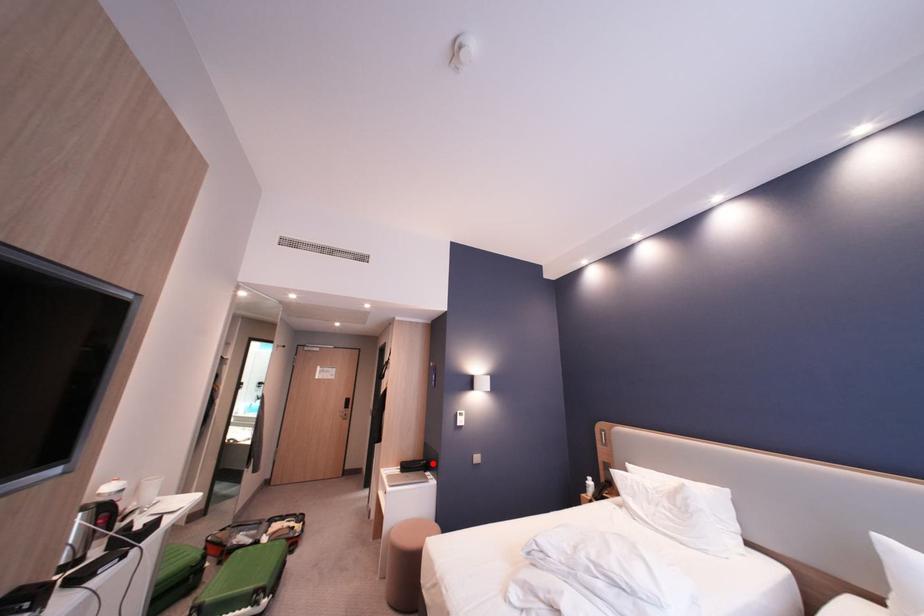
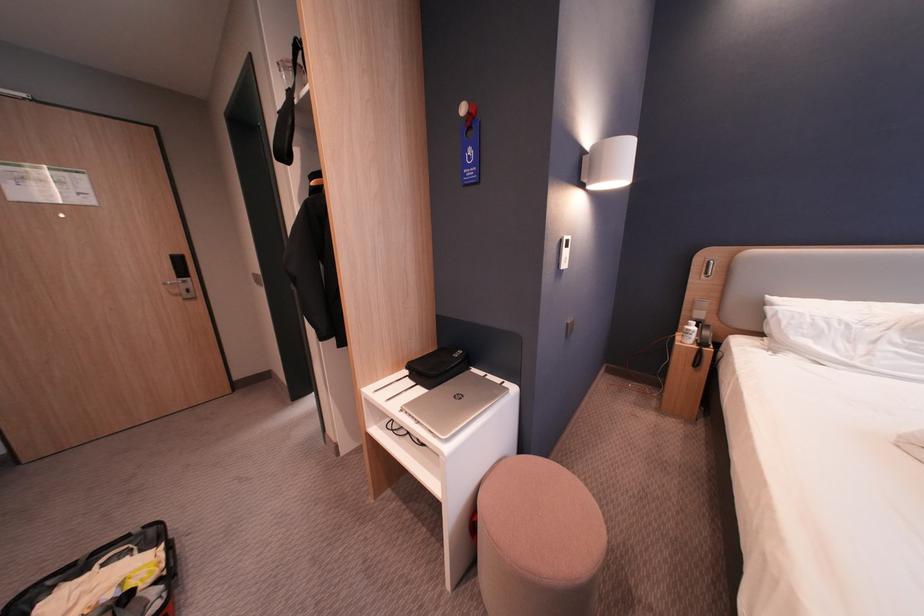
Question: I am providing you with two images of the same scene from different viewpoints. Given a red point in image1, look at the same physical point in image2. Is it:

Choices:
 (A) Closer to the viewpoint
 (B) Farther from the viewpoint

Answer: (A)